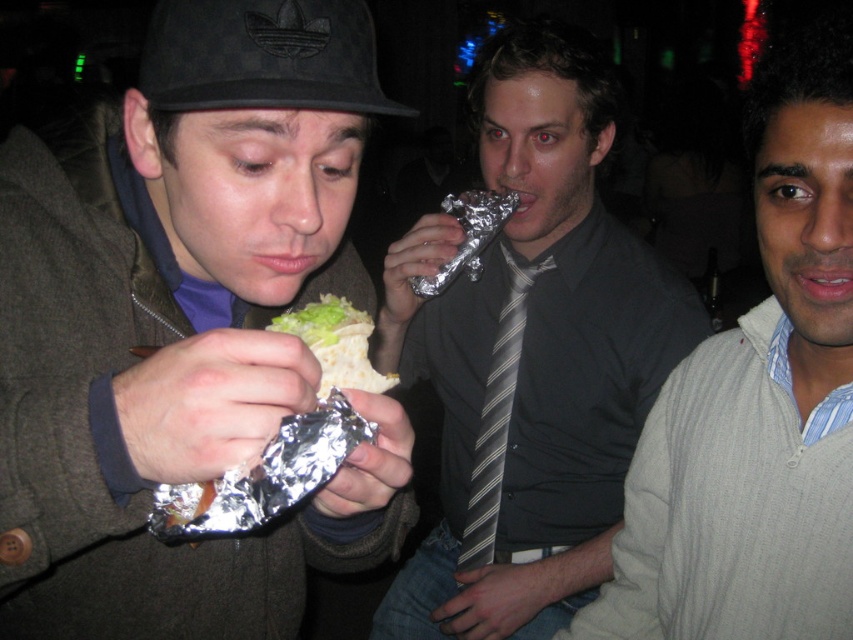
In the scene where three people are eating, there is a person in the middle wearing a striped tie. What object is located at the coordinates point (531, 355)?

The point (531, 355) indicates the striped tie at center.

You are organizing a clothing donation drive and need to categorize items based on their size. You have two items to sort out from the image description provided. The items are the gray ribbed sweater at right and the striped fabric tie at center. Which item should be placed in the larger size bin?

The gray ribbed sweater at right is larger in size than the striped fabric tie at center, so it should be placed in the larger size bin.